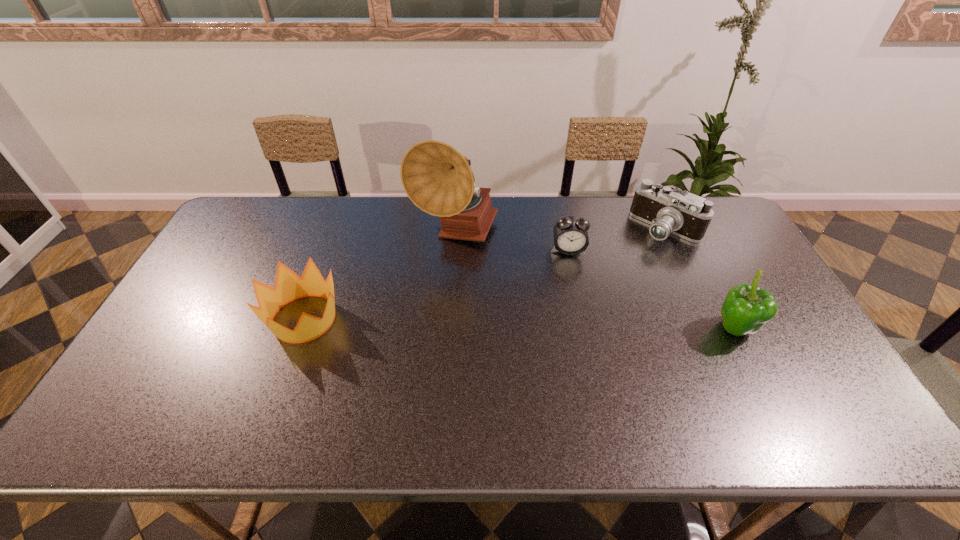
You are a GUI agent. You are given a task and a screenshot of the screen. Output one action in this format:
    pyautogui.click(x=<x>, y=<y>)
    Task: Click on the camera present at the right edge
    Image resolution: width=960 pixels, height=540 pixels.
    Given the screenshot: What is the action you would take?
    pyautogui.click(x=686, y=215)

In order to click on object located at the far right corner in this screenshot , I will do `click(686, 215)`.

Locate an element on the screen. The width and height of the screenshot is (960, 540). vacant area at the far edge of the desktop is located at coordinates (587, 205).

Image resolution: width=960 pixels, height=540 pixels. I want to click on vacant space at the near edge of the desktop, so click(x=541, y=394).

Where is `free point at the right edge`? The height and width of the screenshot is (540, 960). free point at the right edge is located at coordinates (722, 264).

Where is `free space at the near right corner of the desktop`? The image size is (960, 540). free space at the near right corner of the desktop is located at coordinates (824, 385).

Locate an element on the screen. vacant area that lies between the second tallest object and the alarm clock is located at coordinates (651, 289).

Where is `free space between the tallest object and the crown`? free space between the tallest object and the crown is located at coordinates (380, 276).

Where is `empty location between the crown and the bell pepper`? empty location between the crown and the bell pepper is located at coordinates (519, 324).

Identify the location of free space between the bell pepper and the camera. (700, 279).